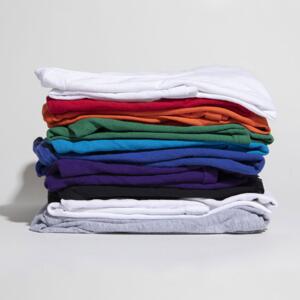
At what (x,y) coordinates should I click in order to perform the action: click on folded clothing items. Please return your answer as a coordinate pair (x, y). The width and height of the screenshot is (300, 300). Looking at the image, I should click on (124, 93), (126, 110), (141, 117), (143, 131), (143, 147), (150, 157), (150, 178), (155, 193), (154, 210), (151, 226).